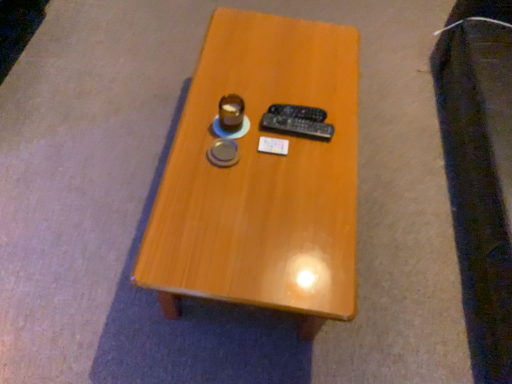
Find the location of a particular element. The width and height of the screenshot is (512, 384). free spot above wooden table at center (from a real-world perspective) is located at coordinates (266, 132).